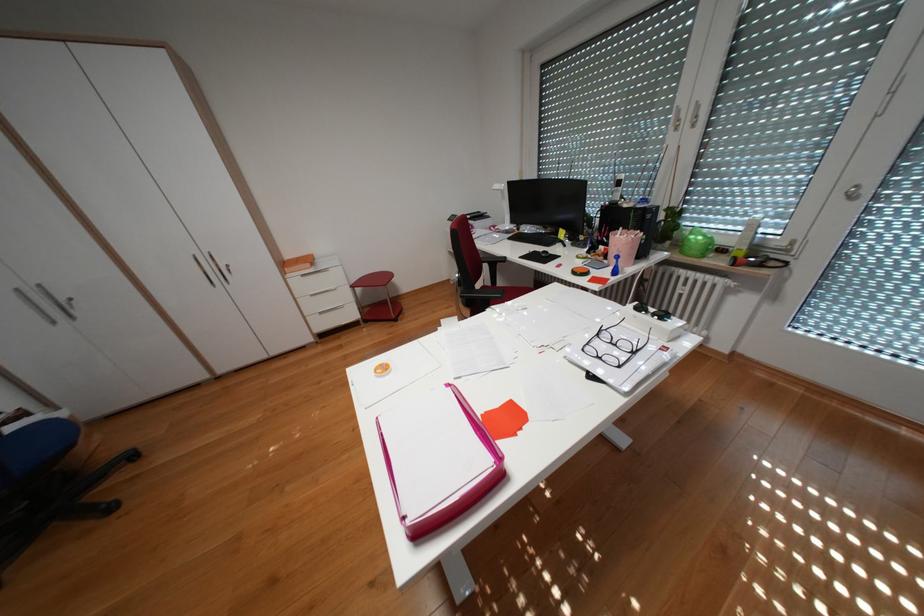
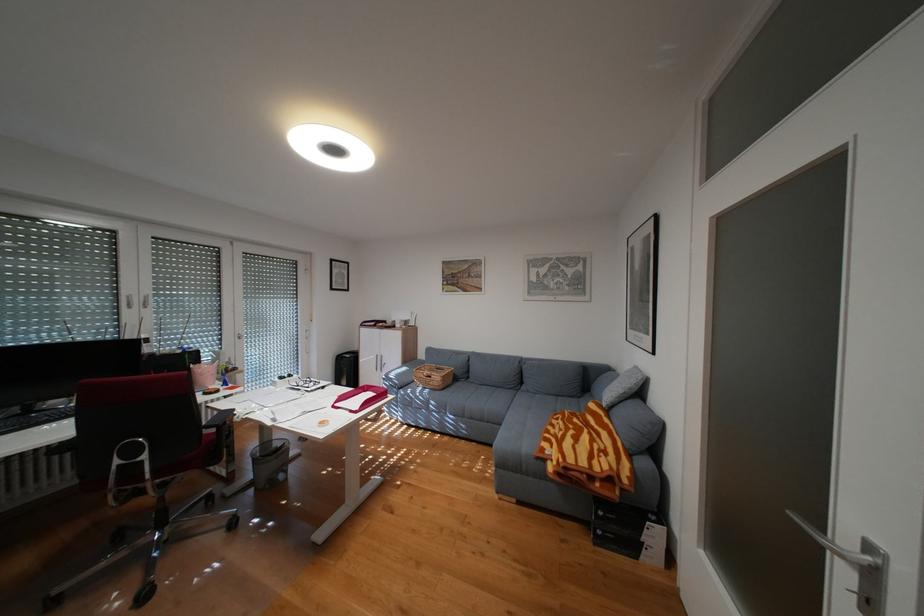
In the second image, find the point that corresponds to [659,310] in the first image.

(297, 377)